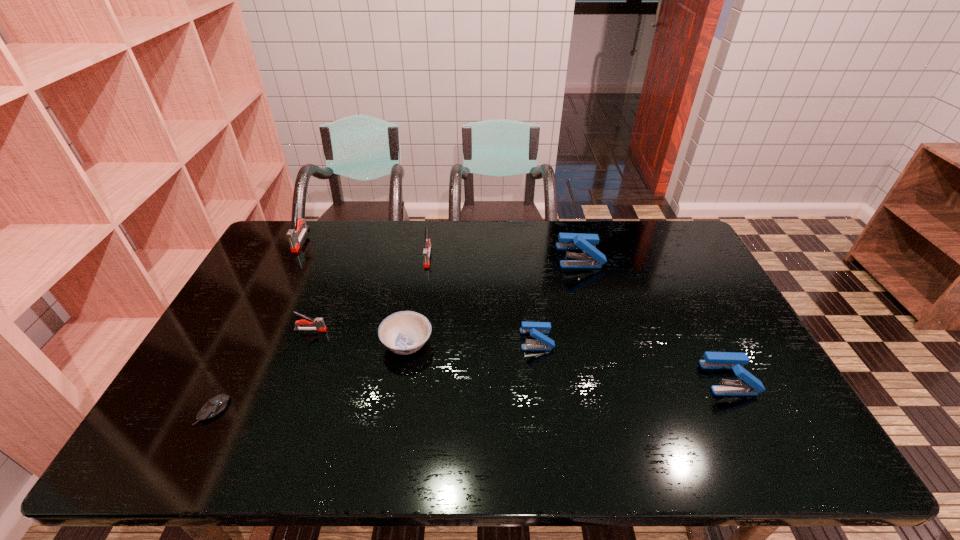
At what (x,y) coordinates should I click in order to perform the action: click on vacant region that satisfies the following two spatial constraints: 1. on the handle side of the nearest stapler; 2. on the right side of the leftmost stapler. Please return your answer as a coordinate pair (x, y). The image size is (960, 540). Looking at the image, I should click on (229, 378).

Locate an element on the screen. This screenshot has width=960, height=540. vacant space that satisfies the following two spatial constraints: 1. on the handle side of the fourth stapler from right to left; 2. on the left side of the rightmost object is located at coordinates (411, 378).

Locate an element on the screen. This screenshot has width=960, height=540. vacant space that satisfies the following two spatial constraints: 1. on the handle side of the bowl; 2. on the left side of the biggest gray stapler is located at coordinates (248, 343).

You are a GUI agent. You are given a task and a screenshot of the screen. Output one action in this format:
    pyautogui.click(x=<x>, y=<y>)
    Task: Click on the vacant space that satisfies the following two spatial constraints: 1. on the handle side of the second nearest blue stapler; 2. on the left side of the leftmost stapler
    This screenshot has width=960, height=540.
    Given the screenshot: What is the action you would take?
    pyautogui.click(x=250, y=340)

Identify the location of free location that satisfies the following two spatial constraints: 1. on the handle side of the blue bowl; 2. on the left side of the biggest gray stapler. click(248, 343).

The image size is (960, 540). Find the location of `blank area in the image that satisfies the following two spatial constraints: 1. on the back side of the second farthest blue stapler; 2. on the handle side of the smallest gray stapler`. blank area in the image that satisfies the following two spatial constraints: 1. on the back side of the second farthest blue stapler; 2. on the handle side of the smallest gray stapler is located at coordinates (536, 330).

Where is `blank area in the image that satisfies the following two spatial constraints: 1. on the handle side of the second gray stapler from right to left; 2. on the left side of the bowl`? blank area in the image that satisfies the following two spatial constraints: 1. on the handle side of the second gray stapler from right to left; 2. on the left side of the bowl is located at coordinates (305, 343).

Locate an element on the screen. Image resolution: width=960 pixels, height=540 pixels. free space that satisfies the following two spatial constraints: 1. on the handle side of the second biggest gray stapler; 2. on the right side of the rightmost stapler is located at coordinates pos(411,378).